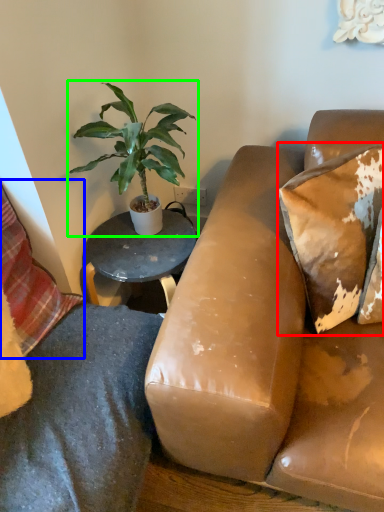
Question: Considering the real-world distances, which object is farthest from pillow (highlighted by a red box)? pillow (highlighted by a blue box) or houseplant (highlighted by a green box)?

Choices:
 (A) pillow
 (B) houseplant

Answer: (A)